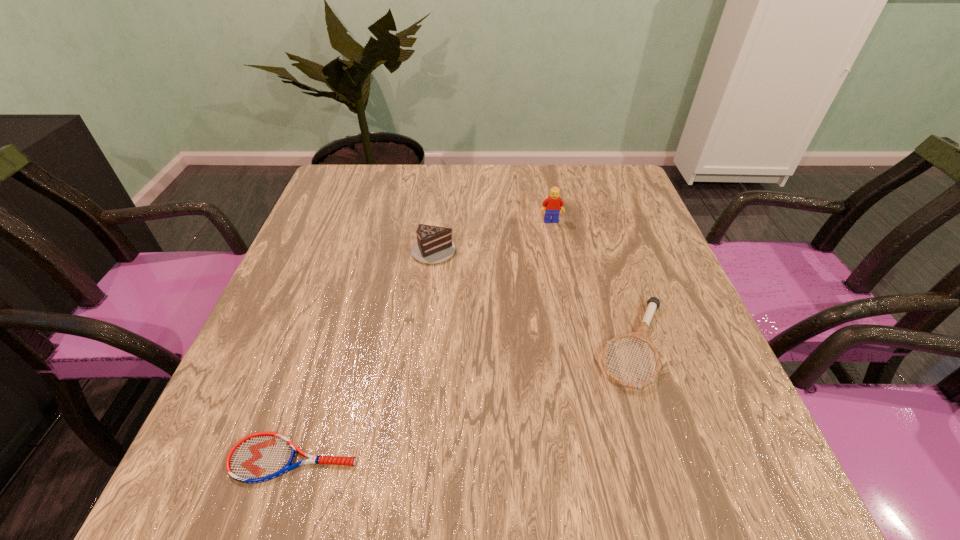
At what (x,y) coordinates should I click in order to perform the action: click on empty space between the third nearest object and the right tennis racket. Please return your answer as a coordinate pair (x, y). The image size is (960, 540). Looking at the image, I should click on (534, 297).

Where is `object that ranks as the third closest to the shorter tennis racket`? object that ranks as the third closest to the shorter tennis racket is located at coordinates (553, 203).

Locate which object is the closest to the second object from right to left. Please provide its 2D coordinates. Your answer should be formatted as a tuple, i.e. [(x, y)], where the tuple contains the x and y coordinates of a point satisfying the conditions above.

[(434, 244)]

Find the location of a particular element. blank space that satisfies the following two spatial constraints: 1. on the face of the taller tennis racket; 2. on the right side of the farthest object is located at coordinates (576, 345).

You are a GUI agent. You are given a task and a screenshot of the screen. Output one action in this format:
    pyautogui.click(x=<x>, y=<y>)
    Task: Click on the vacant space that satisfies the following two spatial constraints: 1. on the back side of the nearer tennis racket; 2. on the left side of the taller tennis racket
    The height and width of the screenshot is (540, 960).
    Given the screenshot: What is the action you would take?
    pyautogui.click(x=329, y=345)